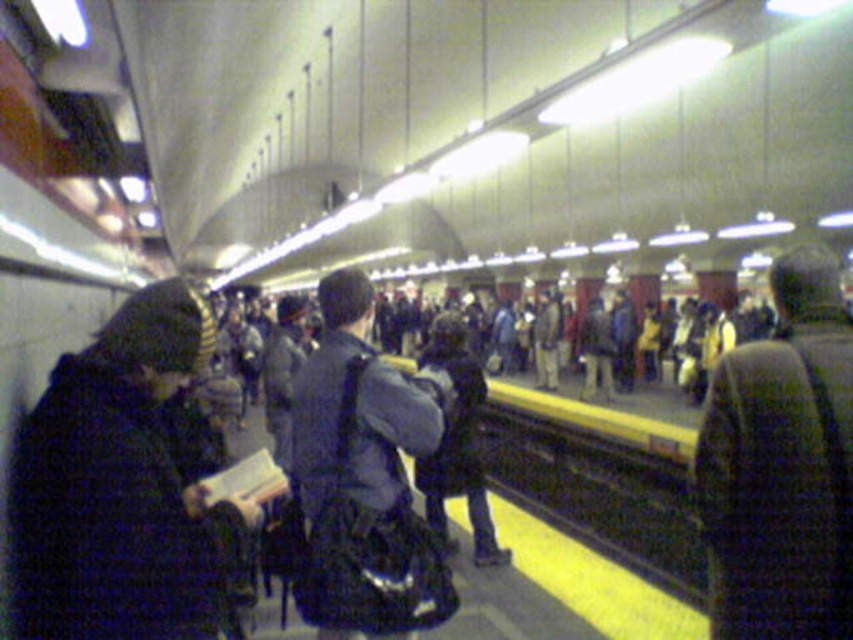
Question: Does black fuzzy coat at left appear under dark blue backpack at center?

Choices:
 (A) yes
 (B) no

Answer: (B)

Question: Among these points, which one is farthest from the camera?

Choices:
 (A) (462, 342)
 (B) (80, 481)
 (C) (403, 493)

Answer: (A)

Question: Is dark blue backpack at center bigger than dark blue jacket at center?

Choices:
 (A) yes
 (B) no

Answer: (A)

Question: Is dark blue backpack at center positioned in front of dark blue jacket at center?

Choices:
 (A) yes
 (B) no

Answer: (A)

Question: Which point is farther from the camera taking this photo?

Choices:
 (A) (24, 438)
 (B) (349, 472)
 (C) (769, 440)

Answer: (B)

Question: Which of the following is the farthest from the observer?

Choices:
 (A) knitted wool hat at upper right
 (B) black fuzzy coat at left
 (C) dark blue jacket at center

Answer: (C)